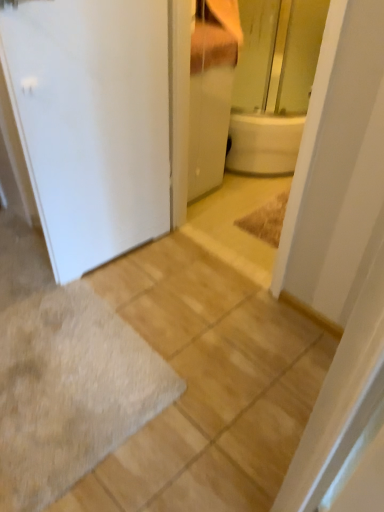
Question: Considering the positions of gray shaggy bath mat at lower left and white matte door at left in the image, is gray shaggy bath mat at lower left bigger or smaller than white matte door at left?

Choices:
 (A) small
 (B) big

Answer: (A)

Question: Considering the relative positions of gray shaggy bath mat at lower left and white matte door at left in the image provided, is gray shaggy bath mat at lower left to the left or to the right of white matte door at left?

Choices:
 (A) left
 (B) right

Answer: (A)

Question: Which object is the farthest from the gray shaggy bath mat at lower left?

Choices:
 (A) white matte door at left
 (B) white glossy cabinet at upper center

Answer: (B)

Question: Estimate the real-world distances between objects in this image. Which object is farther from the white glossy cabinet at upper center?

Choices:
 (A) white matte door at left
 (B) gray shaggy bath mat at lower left

Answer: (B)